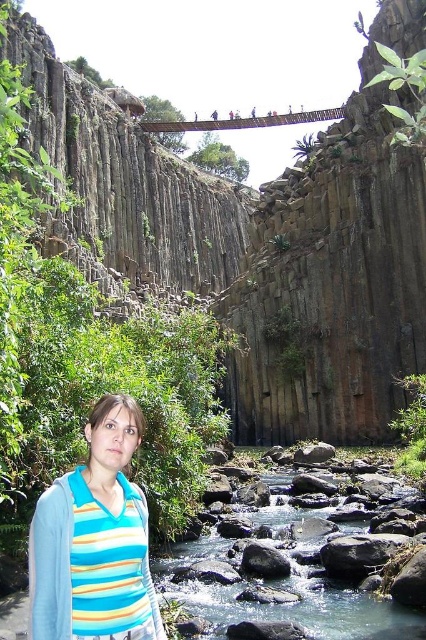
At what (x,y) coordinates should I click in order to perform the action: click on brown rock canyon at center. Please return your answer as a coordinate pair (x, y). Looking at the image, I should click on (273, 246).

The image size is (426, 640). What do you see at coordinates (273, 246) in the screenshot?
I see `brown rock canyon at center` at bounding box center [273, 246].

Locate an element on the screen. The width and height of the screenshot is (426, 640). brown rock canyon at center is located at coordinates (273, 246).

Does striped fabric at lower left appear under clear water stream at center?

Incorrect, striped fabric at lower left is not positioned below clear water stream at center.

Does striped fabric at lower left appear on the right side of clear water stream at center?

In fact, striped fabric at lower left is to the left of clear water stream at center.

At what (x,y) coordinates should I click in order to perform the action: click on striped fabric at lower left. Please return your answer as a coordinate pair (x, y). The image size is (426, 640). Looking at the image, I should click on (94, 540).

Is point (336, 604) in front of point (241, 564)?

That is True.

Measure the distance between point (161, 595) and camera.

Point (161, 595) and camera are 133.61 feet apart from each other.

Is point (249, 620) closer to viewer compared to point (275, 554)?

That is True.

Find the location of a particular element. clear water stream at center is located at coordinates (285, 577).